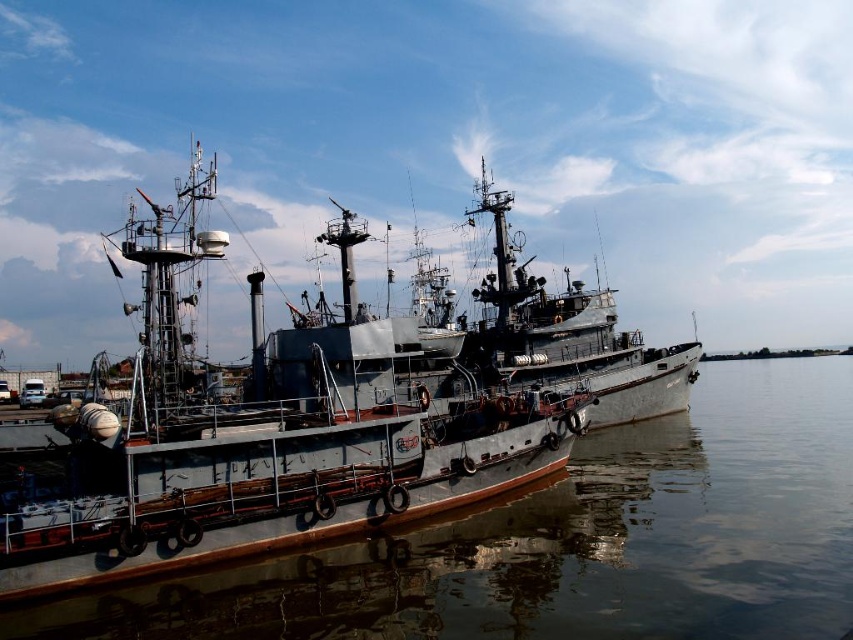
Question: Which object is the farthest from the gray metallic ship at center?

Choices:
 (A) smooth gray water at center
 (B) rusty metal ship at center

Answer: (B)

Question: Does smooth gray water at center have a smaller size compared to gray metallic ship at center?

Choices:
 (A) yes
 (B) no

Answer: (A)

Question: Which point is farther from the camera taking this photo?

Choices:
 (A) (500, 326)
 (B) (653, 497)
 (C) (90, 541)

Answer: (A)

Question: Is gray metallic ship at center smaller than rusty metal ship at center?

Choices:
 (A) yes
 (B) no

Answer: (B)

Question: Does smooth gray water at center appear on the right side of rusty metal ship at center?

Choices:
 (A) no
 (B) yes

Answer: (B)

Question: Which point is farther to the camera?

Choices:
 (A) (409, 557)
 (B) (497, 200)
 (C) (53, 538)

Answer: (B)